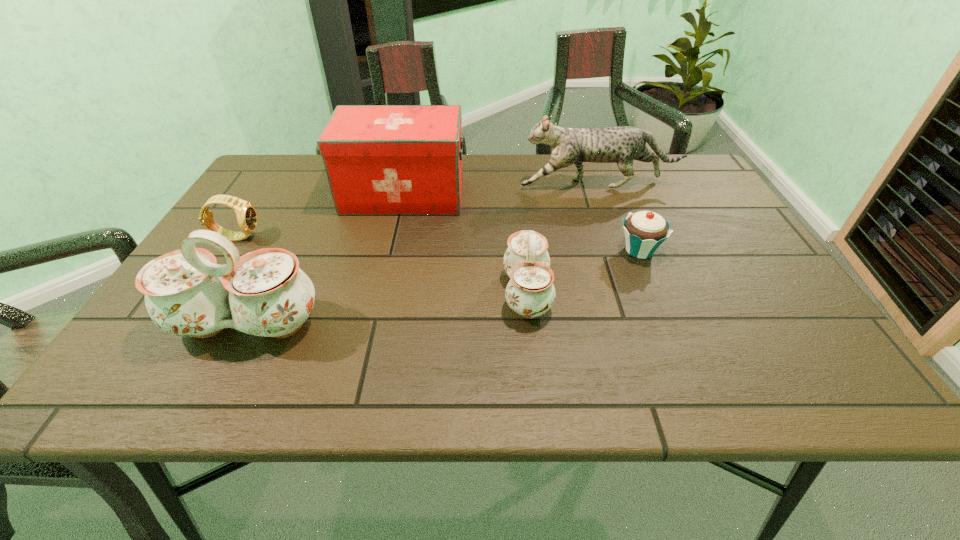
This screenshot has height=540, width=960. Identify the location of object positioned at the right edge. (623, 144).

The width and height of the screenshot is (960, 540). I want to click on object that is at the near left corner, so click(264, 293).

I want to click on object that is positioned at the far right corner, so click(623, 144).

In the image, there is a desktop. Identify the location of vacant space at the far edge. coord(478,179).

In the image, there is a desktop. What are the coordinates of `vacant space at the near edge` in the screenshot? It's located at (468, 338).

Where is `vacant space at the right edge of the desktop`? Image resolution: width=960 pixels, height=540 pixels. vacant space at the right edge of the desktop is located at coordinates (699, 248).

Where is `free space at the far left corner of the desktop`? Image resolution: width=960 pixels, height=540 pixels. free space at the far left corner of the desktop is located at coordinates (297, 168).

Where is `vacant region at the far right corner`? This screenshot has width=960, height=540. vacant region at the far right corner is located at coordinates (660, 185).

Locate an element on the screen. The width and height of the screenshot is (960, 540). free space between the left chinaware and the first-aid kit is located at coordinates (325, 260).

Where is `vacant area that lies between the cupcake and the first-aid kit`? The height and width of the screenshot is (540, 960). vacant area that lies between the cupcake and the first-aid kit is located at coordinates (521, 222).